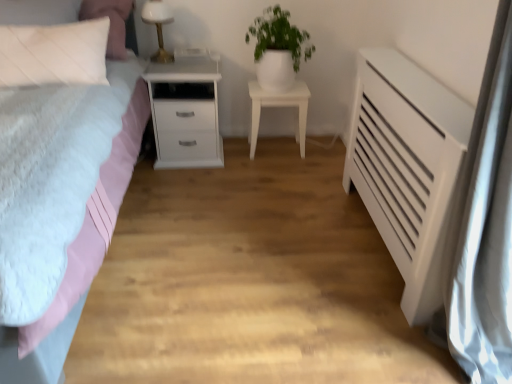
Identify the location of vacant space to the right of white glossy nightstand at center, marked as the 1th nightstand in a right-to-left arrangement. The width and height of the screenshot is (512, 384). pos(324,151).